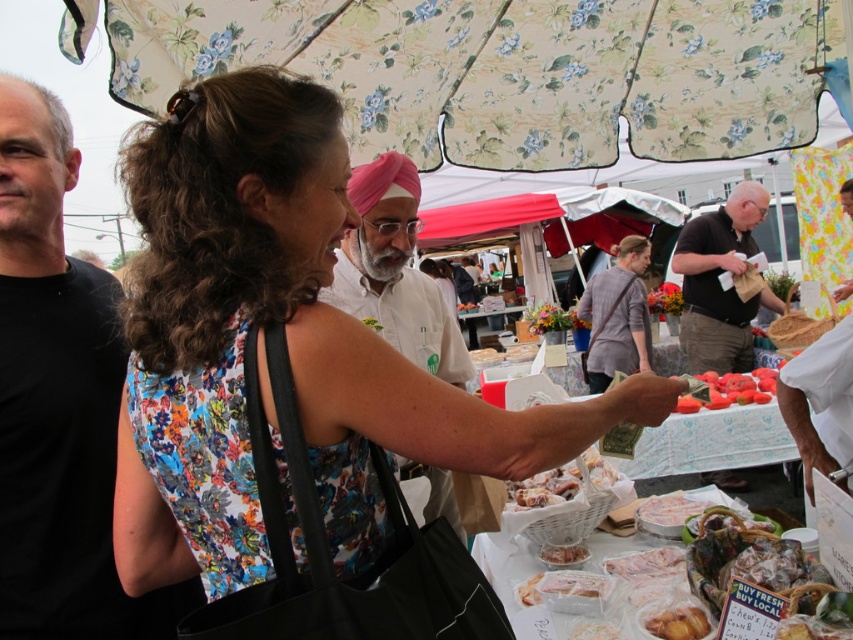
You are a customer at the market and want to buy the golden brown pastry at center. The vendor is wearing the gray cotton shirt at center. When you approach to pay, which item will you need to look up to see more of?

The gray cotton shirt at center is taller than the golden brown pastry at center, so you will need to look up more to see the gray cotton shirt at center.